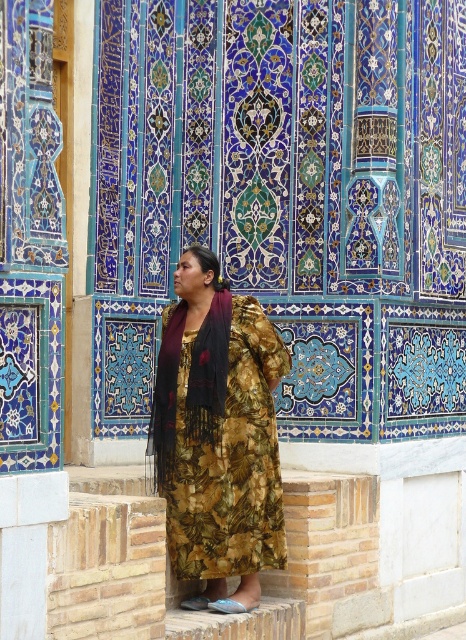
Between floral print dress at center and black fringed scarf at center, which one is positioned lower?

floral print dress at center is below.

Find the location of a particular element. The height and width of the screenshot is (640, 466). floral print dress at center is located at coordinates (218, 435).